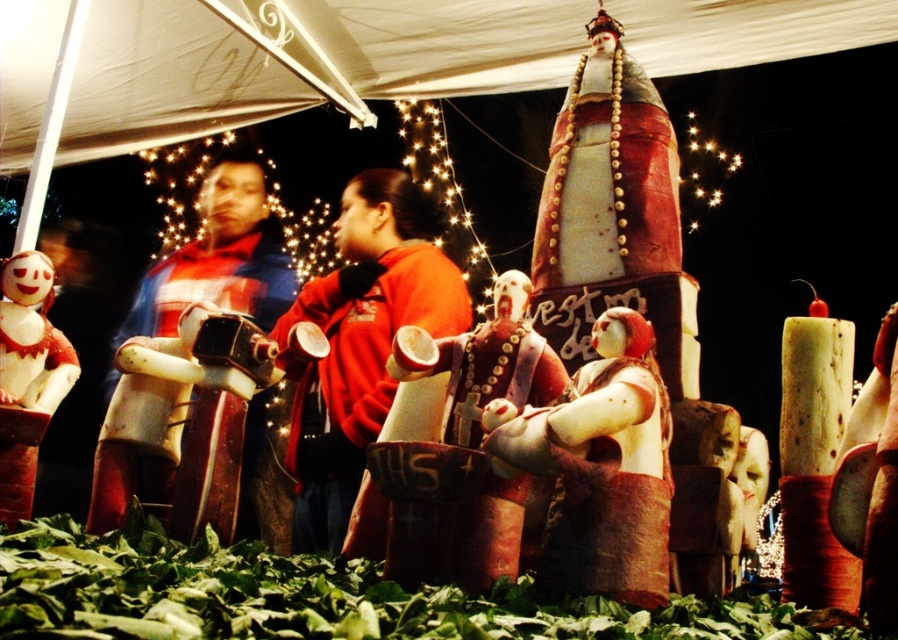
Which is below, matte wooden statue at center or white matte doll at lower left?

matte wooden statue at center is lower down.

The image size is (898, 640). What are the coordinates of `matte wooden statue at center` in the screenshot? It's located at (449, 522).

Can you confirm if red plaid shirt at left is bigger than white matte doll at lower left?

Yes, red plaid shirt at left is bigger than white matte doll at lower left.

Which is above, red plaid shirt at left or white matte doll at lower left?

red plaid shirt at left is higher up.

Is point (263, 259) positioned before point (27, 355)?

No, (263, 259) is behind (27, 355).

Identify the location of red plaid shirt at left. (219, 257).

Consider the image. Does matte white figure at center have a smaller size compared to matte wooden statue at center?

Yes.

Is point (632, 444) positioned before point (514, 364)?

Yes, it is.

This screenshot has height=640, width=898. Find the location of `matte white figure at center`. matte white figure at center is located at coordinates (600, 468).